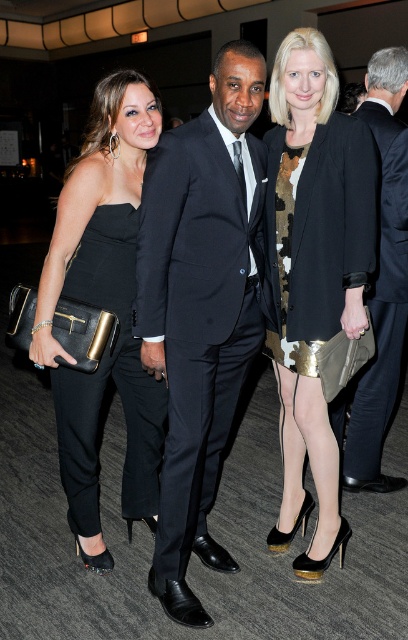
Question: Can you confirm if black satin dress at left is positioned to the right of satin black suit at center?

Choices:
 (A) yes
 (B) no

Answer: (B)

Question: Is matte black suit at center in front of metallic gold skirt at center?

Choices:
 (A) yes
 (B) no

Answer: (A)

Question: Among these objects, which one is farthest from the camera?

Choices:
 (A) matte black suit at center
 (B) metallic gold skirt at center
 (C) satin black suit at center
 (D) black satin dress at left

Answer: (C)

Question: Which object is positioned closest to the matte black suit at center?

Choices:
 (A) satin black suit at center
 (B) metallic gold skirt at center

Answer: (B)

Question: Is black satin dress at left positioned before satin black suit at center?

Choices:
 (A) yes
 (B) no

Answer: (A)

Question: Which point is farther to the camera?

Choices:
 (A) matte black suit at center
 (B) satin black suit at center
 (C) metallic gold skirt at center
 (D) black satin dress at left

Answer: (B)